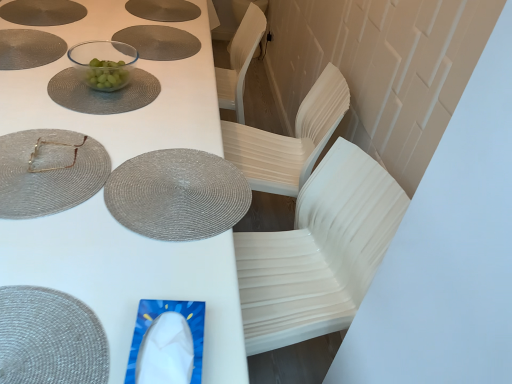
Image resolution: width=512 pixels, height=384 pixels. Identify the location of vacant region in front of matte gray placemat at upper center, which appears as the first plate when viewed from the right. (129, 68).